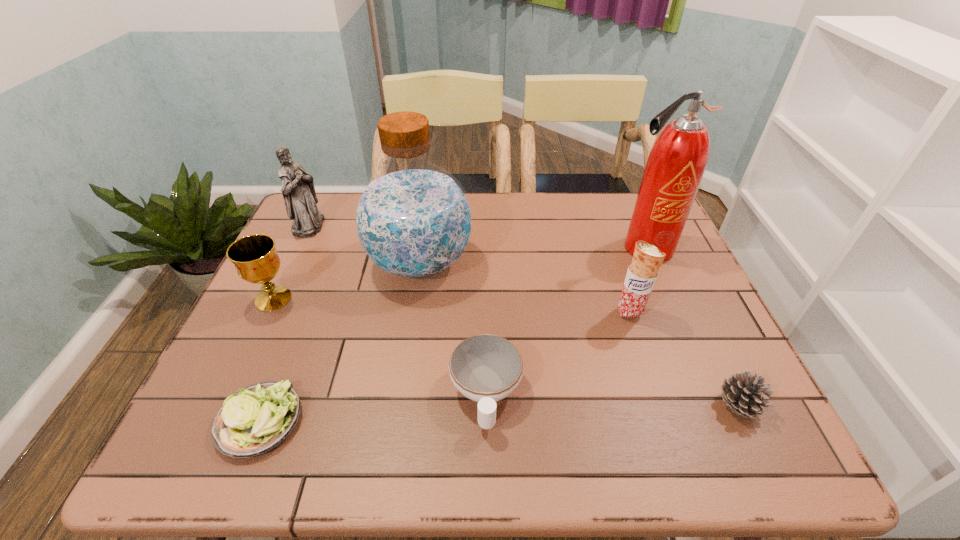
The image size is (960, 540). I want to click on free space at the near edge of the desktop, so click(480, 461).

This screenshot has height=540, width=960. Find the location of `vacant area at the left edge`. vacant area at the left edge is located at coordinates (285, 355).

Find the location of a particular element. The width and height of the screenshot is (960, 540). vacant area at the right edge is located at coordinates pyautogui.click(x=693, y=287).

This screenshot has height=540, width=960. I want to click on free space at the far right corner of the desktop, so click(628, 219).

In the image, there is a desktop. Where is `free space at the near right corner`? The height and width of the screenshot is (540, 960). free space at the near right corner is located at coordinates (776, 437).

This screenshot has width=960, height=540. I want to click on free space between the water jug and the fourth tallest object, so click(x=525, y=288).

At what (x,y) coordinates should I click in order to perform the action: click on free spot between the figurine and the fourth shortest object. Please return your answer as a coordinate pair (x, y). The height and width of the screenshot is (540, 960). Looking at the image, I should click on (291, 262).

What are the coordinates of `vacant area that lies between the chinaware and the water jug` in the screenshot? It's located at (453, 328).

This screenshot has height=540, width=960. Find the location of `vacant space in between the water jug and the chinaware`. vacant space in between the water jug and the chinaware is located at coordinates (453, 328).

Where is `free point between the chalice and the chinaware`? The width and height of the screenshot is (960, 540). free point between the chalice and the chinaware is located at coordinates (379, 346).